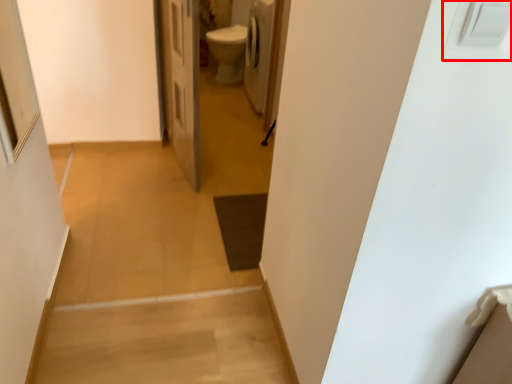
Question: Where is electric outlet (annotated by the red box) located in relation to door in the image?

Choices:
 (A) right
 (B) left

Answer: (A)